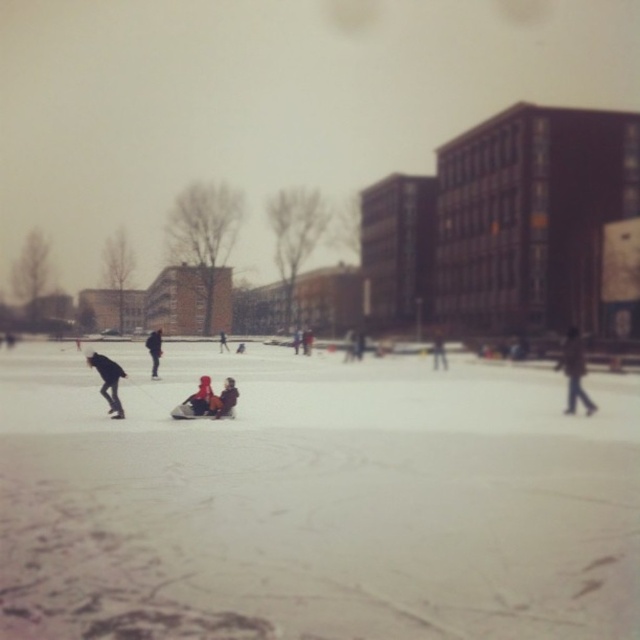
Is point (115, 397) behind point (221, 340)?

That is False.

Who is positioned more to the left, dark blue jacket at left or dark blue jacket at center?

From the viewer's perspective, dark blue jacket at center appears more on the left side.

Which is in front, point (88, 360) or point (221, 349)?

Positioned in front is point (88, 360).

Where is `dark blue jacket at left`? dark blue jacket at left is located at coordinates (108, 380).

Between brown fuzzy coat at right and dark blue jacket at center, which one has less height?

dark blue jacket at center is shorter.

Which is more to the left, brown fuzzy coat at right or dark blue jacket at center?

Positioned to the left is dark blue jacket at center.

Measure the distance between brown fuzzy coat at right and camera.

21.39 meters

Identify the location of brown fuzzy coat at right. (573, 371).

Who is lower down, dark blue jacket at left or dark gray jacket at center?

dark blue jacket at left is below.

Between point (104, 376) and point (150, 376), which one is positioned in front?

Positioned in front is point (104, 376).

You are a GUI agent. You are given a task and a screenshot of the screen. Output one action in this format:
    pyautogui.click(x=<x>, y=<y>)
    Task: Click on the dark blue jacket at left
    The image size is (640, 640).
    Given the screenshot: What is the action you would take?
    pyautogui.click(x=108, y=380)